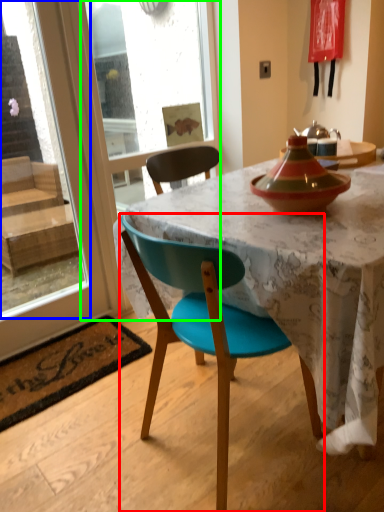
Question: Considering the real-world distances, which object is farthest from chair (highlighted by a red box)? window screen (highlighted by a blue box) or screen door (highlighted by a green box)?

Choices:
 (A) window screen
 (B) screen door

Answer: (A)